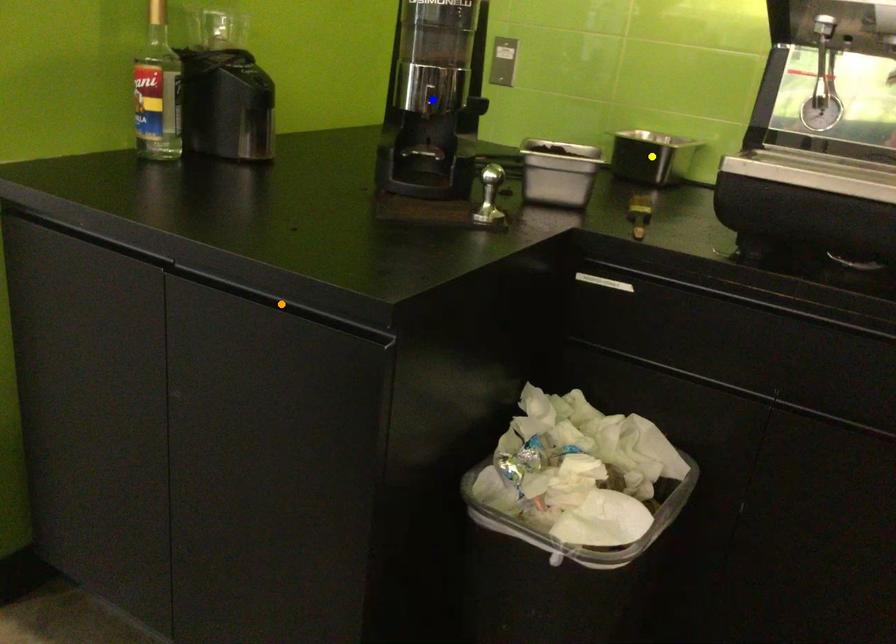
Order these from nearest to farthest:
1. blue point
2. orange point
3. yellow point

orange point, blue point, yellow point